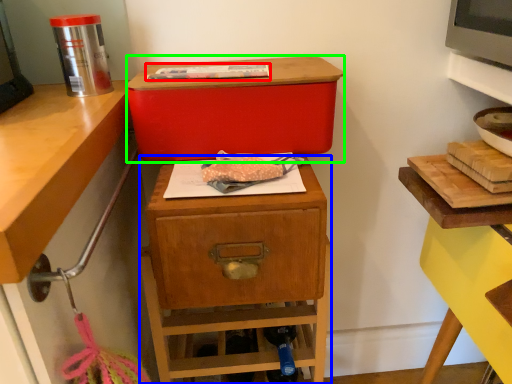
Question: Estimate the real-world distances between objects in this image. Which object is closer to food (highlighted by a red box), nightstand (highlighted by a blue box) or storage box (highlighted by a green box)?

Choices:
 (A) nightstand
 (B) storage box

Answer: (B)